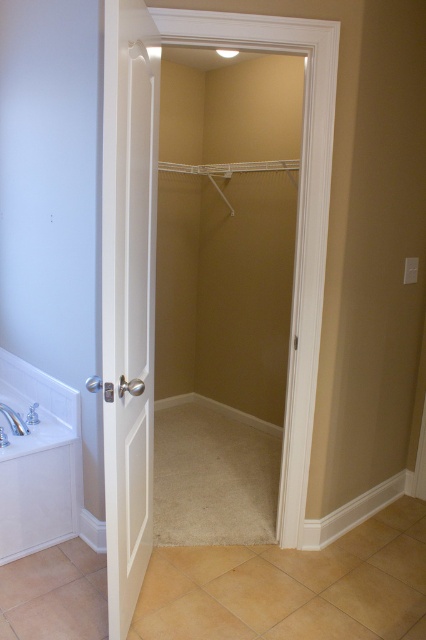
Who is taller, white glossy bathtub at lower left or white porcelain sink at lower left?

Standing taller between the two is white glossy bathtub at lower left.

Is white glossy bathtub at lower left thinner than white porcelain sink at lower left?

No, white glossy bathtub at lower left is not thinner than white porcelain sink at lower left.

At what (x,y) coordinates should I click in order to perform the action: click on white glossy bathtub at lower left. Please return your answer as a coordinate pair (x, y). Image resolution: width=426 pixels, height=640 pixels. Looking at the image, I should click on (39, 461).